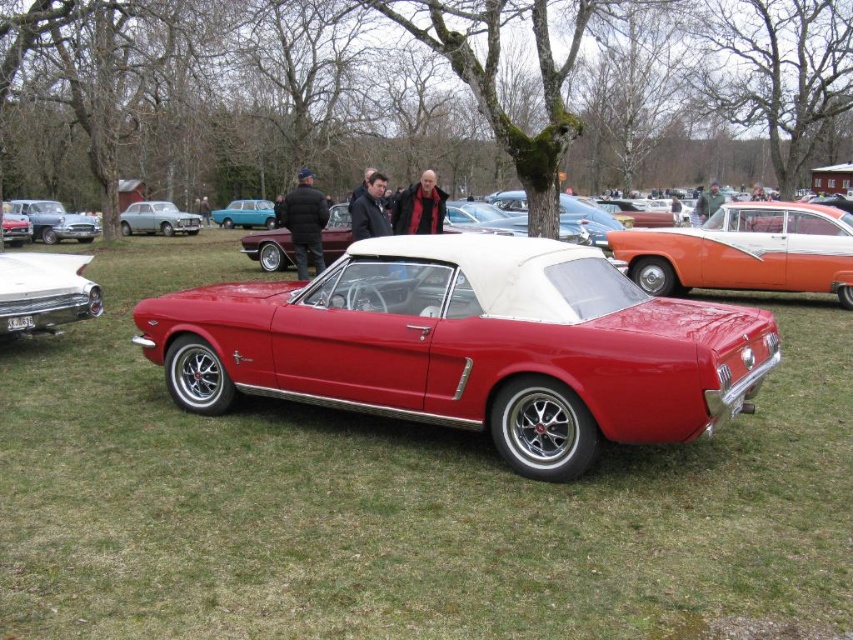
Can you confirm if shiny red convertible at center is positioned below teal metallic sedan at center?

Yes.

Is shiny red convertible at center taller than teal metallic sedan at center?

Yes, shiny red convertible at center is taller than teal metallic sedan at center.

Identify the location of shiny red convertible at center. This screenshot has width=853, height=640. (469, 346).

Is point (321, 253) positioned after point (440, 204)?

Yes, point (321, 253) is farther from viewer.

Which of these two, black leather jacket at center or dark red leather jacket at center, stands taller?

With more height is black leather jacket at center.

Image resolution: width=853 pixels, height=640 pixels. What do you see at coordinates (305, 221) in the screenshot?
I see `black leather jacket at center` at bounding box center [305, 221].

At what (x,y) coordinates should I click in order to perform the action: click on black leather jacket at center. Please return your answer as a coordinate pair (x, y). The image size is (853, 640). Looking at the image, I should click on click(x=305, y=221).

Can you confirm if shiny red convertible at center is thinner than black leather jacket at center?

No.

Does shiny red convertible at center have a greater width compared to black leather jacket at center?

Indeed, shiny red convertible at center has a greater width compared to black leather jacket at center.

Which is in front, point (496, 449) or point (320, 205)?

Point (496, 449) is more forward.

At what (x,y) coordinates should I click in order to perform the action: click on shiny red convertible at center. Please return your answer as a coordinate pair (x, y). Looking at the image, I should click on (469, 346).